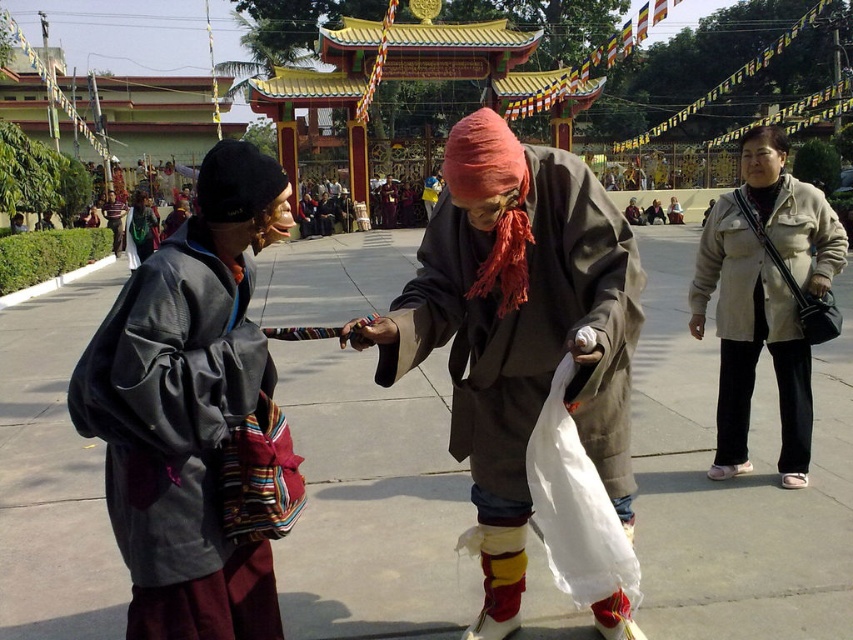
Question: Can you confirm if matte brown robe at center is wider than beige fabric jacket at right?

Choices:
 (A) yes
 (B) no

Answer: (A)

Question: Does matte brown robe at center have a larger size compared to beige fabric jacket at right?

Choices:
 (A) yes
 (B) no

Answer: (A)

Question: Which point appears closest to the camera in this image?

Choices:
 (A) (721, 268)
 (B) (125, 212)
 (C) (132, 220)
 (D) (141, 490)

Answer: (D)

Question: Among these points, which one is farthest from the camera?

Choices:
 (A) (360, 339)
 (B) (113, 195)
 (C) (189, 326)

Answer: (B)

Question: Considering the relative positions of matte brown robe at center and gray cotton robe at left in the image provided, where is matte brown robe at center located with respect to gray cotton robe at left?

Choices:
 (A) below
 (B) above

Answer: (B)

Question: Which object is the closest to the matte black jacket at center?

Choices:
 (A) matte brown robe at center
 (B) gray cotton robe at left
 (C) beige fabric jacket at right
 (D) matte gray jacket at left

Answer: (D)